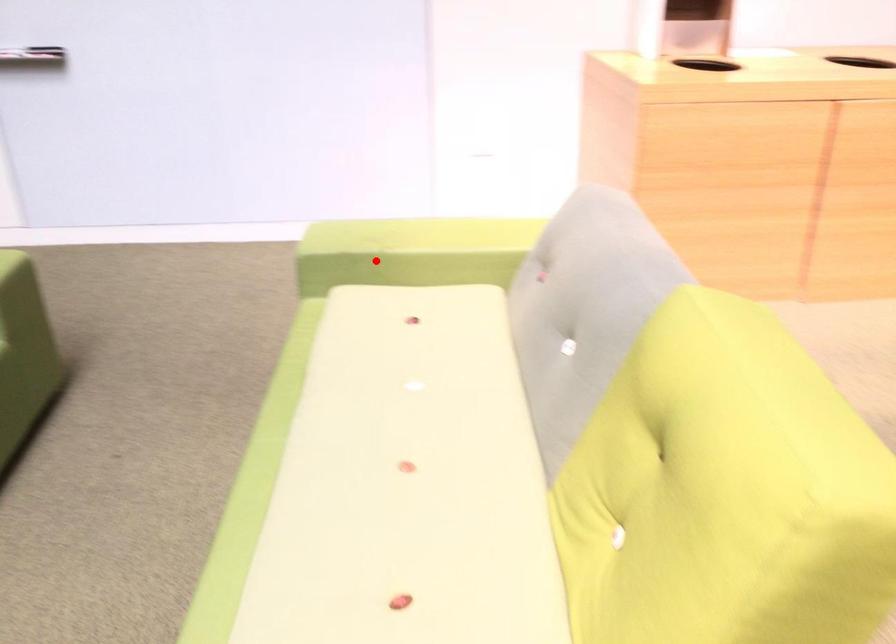
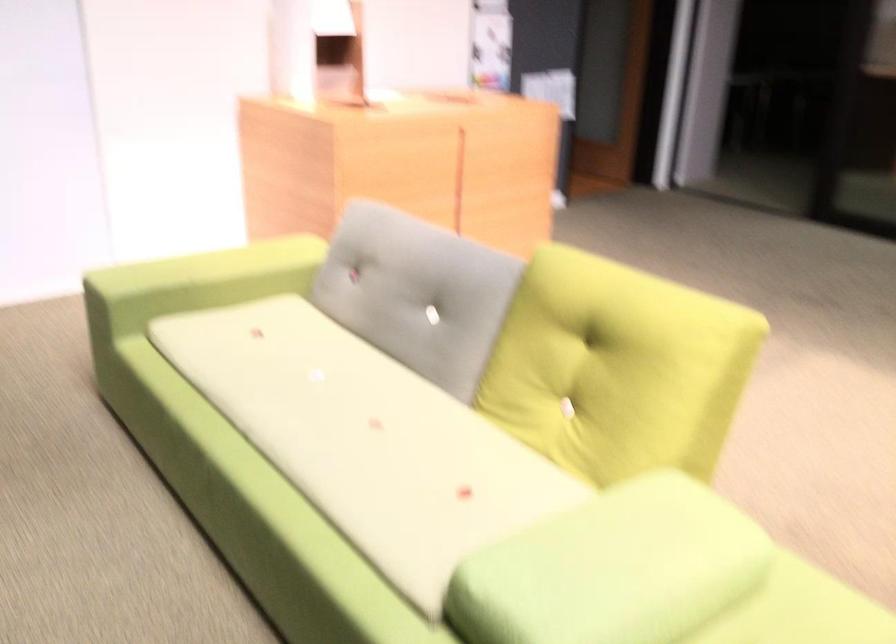
Find the pixel in the second image that matches the highlighted location in the first image.

(194, 283)